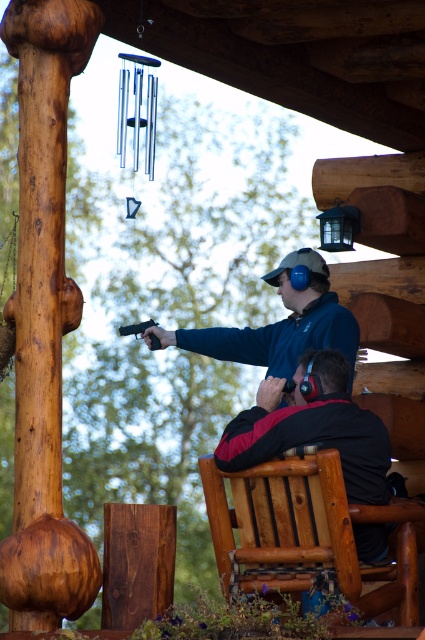
You are standing at the entrance of the shooting range and see the wooden chair at lower right and the blue matte jacket at center. Which object is closer to the ground?

The wooden chair at lower right is closer to the ground because it is positioned below the blue matte jacket at center.

Consider the image. You are organizing a shooting event and need to ensure participants are spaced appropriately. Given that the black matte jacket at center and the blue matte jacket at center are both standing at the center of the area, which participant should move to the side to maintain a wider stance for safety?

The black matte jacket at center should move to the side since it has a lesser width compared to the blue matte jacket at center, allowing more space for the wider participant.